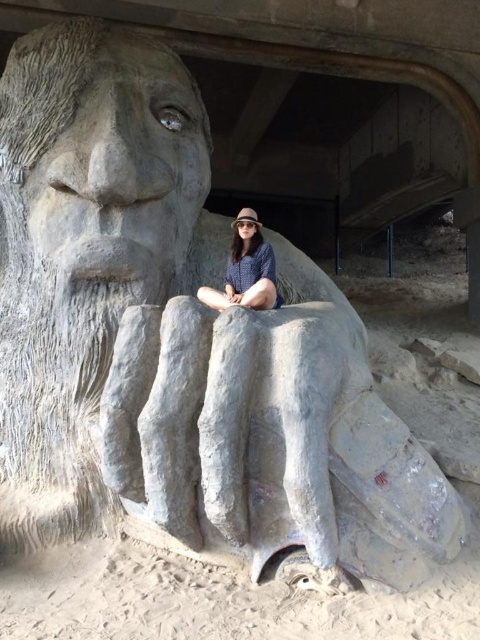
You are standing in front of the stone sculpture and want to take a photo of both the face and the hand. You notice two points marked on the sculpture. Which point is closer to you, point (104, 38) or point (276, 307)?

Point (104, 38) is further to the viewer than point (276, 307). Wait, but the question asks which is closer to you. So actually, point (276, 307) is closer to you because it is less further away. Hmm, maybe I need to rephrase. Let me check the description again. The description says point 0.061,0.217 is further to the viewer than point 0.480,0.577. That means point 0.480 is closer to the viewer. So the answer should state that point 0.480,0.577 is closer to you.

Where is the gray stone head at upper left located in the image?

The gray stone head at upper left is located at point coordinates of (105,154).

You are planning to take a photo of the gray stone head at upper left and the matte gray stone statue at lower center. If you want to capture both objects in the frame without cropping, which object should you position closer to the camera?

You should position the matte gray stone statue at lower center closer to the camera because the gray stone head at upper left is wider, so moving the smaller matte gray stone statue at lower center forward will help fit both in the frame.